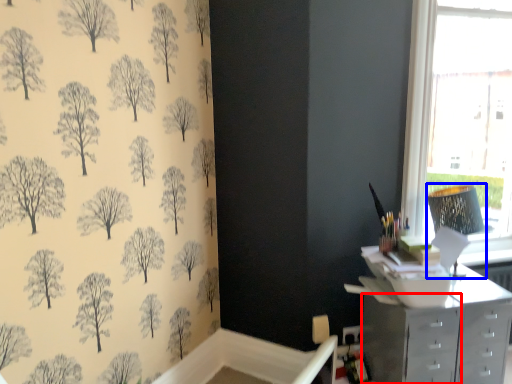
Question: Which object appears farthest to the camera in this image, file cabinet (highlighted by a red box) or lamp (highlighted by a blue box)?

Choices:
 (A) file cabinet
 (B) lamp

Answer: (B)